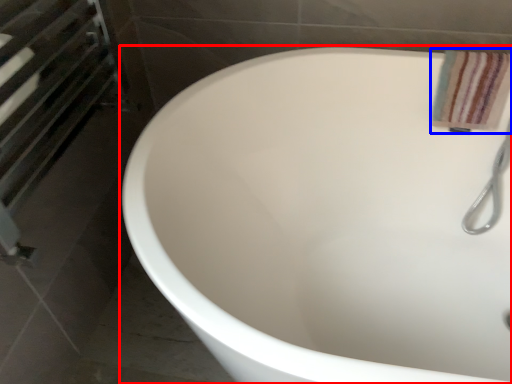
Question: Which object is further to the camera taking this photo, bathtub (highlighted by a red box) or bath towel (highlighted by a blue box)?

Choices:
 (A) bathtub
 (B) bath towel

Answer: (B)